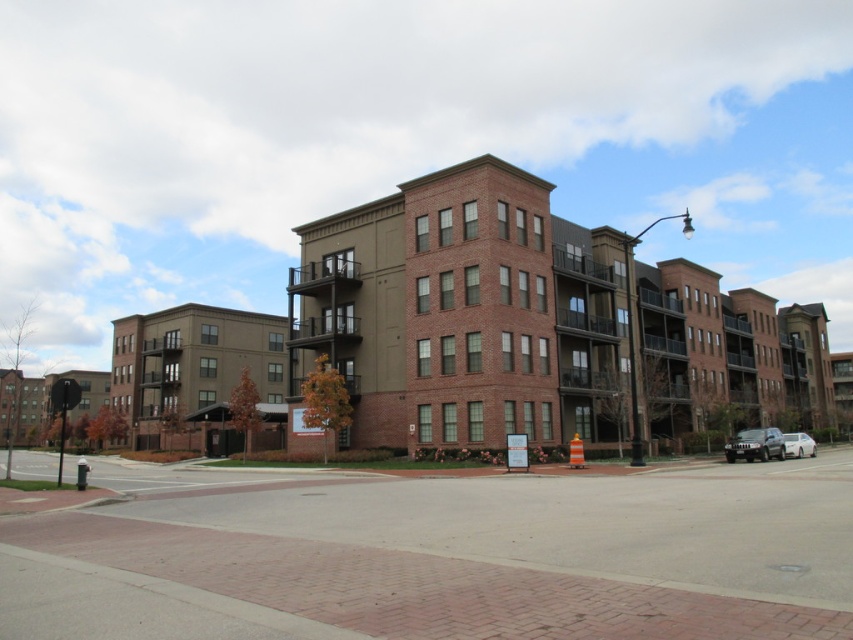
Question: Which of the following is the closest to the observer?

Choices:
 (A) white glossy sedan at right
 (B) metallic silver suv at lower right

Answer: (B)

Question: Can you confirm if metallic silver suv at lower right is thinner than white glossy sedan at right?

Choices:
 (A) yes
 (B) no

Answer: (A)

Question: Where is metallic silver suv at lower right located in relation to white glossy sedan at right in the image?

Choices:
 (A) left
 (B) right

Answer: (A)

Question: Which of the following is the closest to the observer?

Choices:
 (A) metallic silver suv at lower right
 (B) white glossy sedan at right

Answer: (A)

Question: Where is metallic silver suv at lower right located in relation to white glossy sedan at right in the image?

Choices:
 (A) left
 (B) right

Answer: (A)